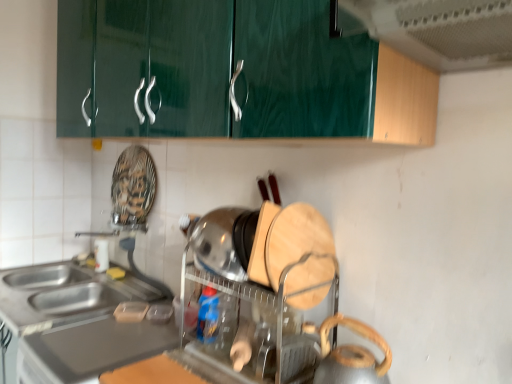
Locate an element on the screen. green glossy exhaust hood at upper center is located at coordinates pyautogui.click(x=439, y=30).

How different are the orientations of green glossy exhaust hood at upper center and wooden cutting board at center, the first appliance viewed from the back, in degrees?

0.491 degrees separate the facing orientations of green glossy exhaust hood at upper center and wooden cutting board at center, the first appliance viewed from the back.

In terms of height, does green glossy exhaust hood at upper center look taller or shorter compared to wooden cutting board at center, marked as the 2th appliance in a front-to-back arrangement?

green glossy exhaust hood at upper center is shorter than wooden cutting board at center, marked as the 2th appliance in a front-to-back arrangement.

Is wooden cutting board at center, the first appliance viewed from the back, located within green glossy exhaust hood at upper center?

No, wooden cutting board at center, the first appliance viewed from the back, is not a part of green glossy exhaust hood at upper center.

How distant is green glossy exhaust hood at upper center from wooden cutting board at center, the first appliance viewed from the back?

They are 68.63 centimeters apart.

Considering the sizes of objects wooden cutting board at center, marked as the 2th appliance in a front-to-back arrangement, and metallic silver kettle at lower right, arranged as the 2th appliance when viewed from the back, in the image provided, who is smaller, wooden cutting board at center, marked as the 2th appliance in a front-to-back arrangement, or metallic silver kettle at lower right, arranged as the 2th appliance when viewed from the back,?

With smaller size is metallic silver kettle at lower right, arranged as the 2th appliance when viewed from the back.

Consider the image. Is wooden cutting board at center, the first appliance viewed from the back, oriented away from metallic silver kettle at lower right, which ranks as the first appliance in front-to-back order?

No, wooden cutting board at center, the first appliance viewed from the back, is not facing away from metallic silver kettle at lower right, which ranks as the first appliance in front-to-back order.

From the image's perspective, which one is positioned lower, wooden cutting board at center, marked as the 2th appliance in a front-to-back arrangement, or metallic silver kettle at lower right, arranged as the 2th appliance when viewed from the back?

metallic silver kettle at lower right, arranged as the 2th appliance when viewed from the back.

Looking at this image, can you confirm if wooden cutting board at center, the first appliance viewed from the back, is shorter than metallic silver kettle at lower right, which ranks as the first appliance in front-to-back order?

In fact, wooden cutting board at center, the first appliance viewed from the back, may be taller than metallic silver kettle at lower right, which ranks as the first appliance in front-to-back order.

Is point (379, 12) less distant than point (368, 351)?

Yes, point (379, 12) is closer to viewer.

How much distance is there between green glossy exhaust hood at upper center and metallic silver kettle at lower right, which ranks as the first appliance in front-to-back order?

A distance of 26.47 inches exists between green glossy exhaust hood at upper center and metallic silver kettle at lower right, which ranks as the first appliance in front-to-back order.

From the image's perspective, is green glossy exhaust hood at upper center under metallic silver kettle at lower right, arranged as the 2th appliance when viewed from the back?

No.

Can you confirm if metallic silver kettle at lower right, arranged as the 2th appliance when viewed from the back, is bigger than wooden cutting board at center, marked as the 2th appliance in a front-to-back arrangement?

Actually, metallic silver kettle at lower right, arranged as the 2th appliance when viewed from the back, might be smaller than wooden cutting board at center, marked as the 2th appliance in a front-to-back arrangement.

Considering the positions of objects metallic silver kettle at lower right, arranged as the 2th appliance when viewed from the back, and wooden cutting board at center, marked as the 2th appliance in a front-to-back arrangement, in the image provided, who is more to the left, metallic silver kettle at lower right, arranged as the 2th appliance when viewed from the back, or wooden cutting board at center, marked as the 2th appliance in a front-to-back arrangement,?

From the viewer's perspective, wooden cutting board at center, marked as the 2th appliance in a front-to-back arrangement, appears more on the left side.

Could you tell me if metallic silver kettle at lower right, which ranks as the first appliance in front-to-back order, is turned towards wooden cutting board at center, marked as the 2th appliance in a front-to-back arrangement?

No, metallic silver kettle at lower right, which ranks as the first appliance in front-to-back order, is not facing towards wooden cutting board at center, marked as the 2th appliance in a front-to-back arrangement.

There is a metallic silver kettle at lower right, arranged as the 2th appliance when viewed from the back. Where is `appliance above it (from a real-world perspective)`? Image resolution: width=512 pixels, height=384 pixels. appliance above it (from a real-world perspective) is located at coordinates (256, 291).

Does wooden cutting board at center, marked as the 2th appliance in a front-to-back arrangement, lie in front of green glossy exhaust hood at upper center?

No, it is not.

What's the angular difference between wooden cutting board at center, the first appliance viewed from the back, and green glossy exhaust hood at upper center's facing directions?

There is a 0.491-degree angle between the facing directions of wooden cutting board at center, the first appliance viewed from the back, and green glossy exhaust hood at upper center.

Image resolution: width=512 pixels, height=384 pixels. I want to click on appliance that is the 1st object directly below the green glossy exhaust hood at upper center (from a real-world perspective), so click(256, 291).

Is wooden cutting board at center, marked as the 2th appliance in a front-to-back arrangement, smaller than green glossy exhaust hood at upper center?

Actually, wooden cutting board at center, marked as the 2th appliance in a front-to-back arrangement, might be larger than green glossy exhaust hood at upper center.

From the image's perspective, which one is positioned lower, satin silver countertop at lower left or metallic silver kettle at lower right, which ranks as the first appliance in front-to-back order?

A: satin silver countertop at lower left is shown below in the image.

How different are the orientations of satin silver countertop at lower left and metallic silver kettle at lower right, arranged as the 2th appliance when viewed from the back, in degrees?

The angular difference between satin silver countertop at lower left and metallic silver kettle at lower right, arranged as the 2th appliance when viewed from the back, is 0.2 degrees.

Identify the location of the 1st appliance located above the satin silver countertop at lower left (from a real-world perspective). The image size is (512, 384). tap(351, 356).

Is satin silver countertop at lower left located outside metallic silver kettle at lower right, arranged as the 2th appliance when viewed from the back?

Absolutely, satin silver countertop at lower left is external to metallic silver kettle at lower right, arranged as the 2th appliance when viewed from the back.

Based on the photo, from the image's perspective, is satin silver countertop at lower left positioned above or below wooden cutting board at center, marked as the 2th appliance in a front-to-back arrangement?

From the image's perspective, satin silver countertop at lower left appears below wooden cutting board at center, marked as the 2th appliance in a front-to-back arrangement.

In the scene shown: Between satin silver countertop at lower left and wooden cutting board at center, the first appliance viewed from the back, which one has larger size?

satin silver countertop at lower left.

Considering the positions of points (8, 276) and (259, 368), is point (8, 276) farther from camera compared to point (259, 368)?

Yes, point (8, 276) is farther from viewer.

Between satin silver countertop at lower left and wooden cutting board at center, the first appliance viewed from the back, which one has less height?

satin silver countertop at lower left is shorter.

Image resolution: width=512 pixels, height=384 pixels. What are the coordinates of `exhaust hood above the wooden cutting board at center, marked as the 2th appliance in a front-to-back arrangement (from a real-world perspective)` in the screenshot? It's located at (439, 30).

The image size is (512, 384). What are the coordinates of `appliance that appears below the wooden cutting board at center, marked as the 2th appliance in a front-to-back arrangement (from a real-world perspective)` in the screenshot? It's located at (351, 356).

Which object lies further to the anchor point wooden cutting board at center, the first appliance viewed from the back, metallic silver kettle at lower right, arranged as the 2th appliance when viewed from the back, or satin silver countertop at lower left?

Based on the image, satin silver countertop at lower left appears to be further to wooden cutting board at center, the first appliance viewed from the back.

Which object lies nearer to the anchor point metallic silver kettle at lower right, arranged as the 2th appliance when viewed from the back, green glossy exhaust hood at upper center or wooden cutting board at center, marked as the 2th appliance in a front-to-back arrangement?

wooden cutting board at center, marked as the 2th appliance in a front-to-back arrangement, is positioned closer to the anchor metallic silver kettle at lower right, arranged as the 2th appliance when viewed from the back.

Based on their spatial positions, is metallic silver kettle at lower right, arranged as the 2th appliance when viewed from the back, or green glossy exhaust hood at upper center further from wooden cutting board at center, the first appliance viewed from the back?

green glossy exhaust hood at upper center lies further to wooden cutting board at center, the first appliance viewed from the back, than the other object.

Based on their spatial positions, is wooden cutting board at center, the first appliance viewed from the back, or satin silver countertop at lower left closer to green glossy exhaust hood at upper center?

wooden cutting board at center, the first appliance viewed from the back.

Estimate the real-world distances between objects in this image. Which object is closer to metallic silver kettle at lower right, arranged as the 2th appliance when viewed from the back, satin silver countertop at lower left or green glossy exhaust hood at upper center?

The object closer to metallic silver kettle at lower right, arranged as the 2th appliance when viewed from the back, is green glossy exhaust hood at upper center.

From the image, which object appears to be farther from metallic silver kettle at lower right, arranged as the 2th appliance when viewed from the back, wooden cutting board at center, marked as the 2th appliance in a front-to-back arrangement, or green glossy exhaust hood at upper center?

Among the two, green glossy exhaust hood at upper center is located further to metallic silver kettle at lower right, arranged as the 2th appliance when viewed from the back.

Which object lies nearer to the anchor point wooden cutting board at center, marked as the 2th appliance in a front-to-back arrangement, green glossy exhaust hood at upper center or satin silver countertop at lower left?

satin silver countertop at lower left is closer to wooden cutting board at center, marked as the 2th appliance in a front-to-back arrangement.

Estimate the real-world distances between objects in this image. Which object is closer to green glossy exhaust hood at upper center, satin silver countertop at lower left or wooden cutting board at center, the first appliance viewed from the back?

wooden cutting board at center, the first appliance viewed from the back, is positioned closer to the anchor green glossy exhaust hood at upper center.

Where is `appliance between green glossy exhaust hood at upper center and metallic silver kettle at lower right, arranged as the 2th appliance when viewed from the back, vertically`? appliance between green glossy exhaust hood at upper center and metallic silver kettle at lower right, arranged as the 2th appliance when viewed from the back, vertically is located at coordinates (256, 291).

Locate an element on the screen. appliance between satin silver countertop at lower left and metallic silver kettle at lower right, arranged as the 2th appliance when viewed from the back is located at coordinates (256, 291).